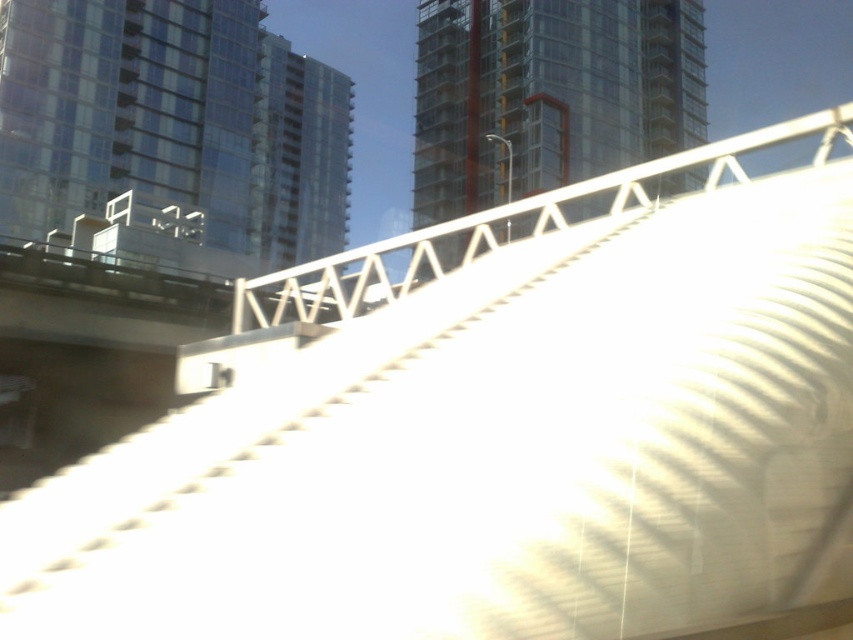
Who is positioned more to the left, transparent glass tower at upper center or transparent glass building at center?

From the viewer's perspective, transparent glass building at center appears more on the left side.

Is transparent glass tower at upper center positioned at the back of transparent glass building at center?

No, transparent glass tower at upper center is closer to the viewer.

Where is `transparent glass tower at upper center`? This screenshot has width=853, height=640. transparent glass tower at upper center is located at coordinates (549, 93).